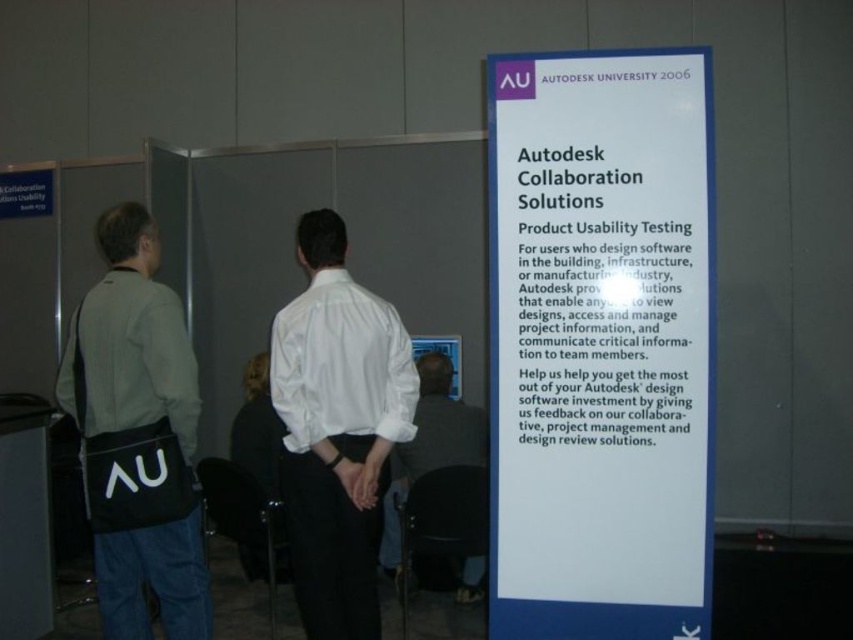
Question: Among these objects, which one is nearest to the camera?

Choices:
 (A) black fabric bag at left
 (B) white cotton shirt at center
 (C) white shirt at center

Answer: (A)

Question: Observing the image, what is the correct spatial positioning of white satin shirt at center in reference to white shirt at center?

Choices:
 (A) below
 (B) above

Answer: (B)

Question: Is white cotton shirt at center below white shirt at center?

Choices:
 (A) no
 (B) yes

Answer: (A)

Question: Can you confirm if black fabric bag at left is bigger than white shirt at center?

Choices:
 (A) no
 (B) yes

Answer: (A)

Question: Which is nearer to the white satin shirt at center?

Choices:
 (A) white cotton shirt at center
 (B) white paper at upper center
 (C) black fabric bag at left
 (D) white shirt at center

Answer: (A)

Question: Which object appears closest to the camera in this image?

Choices:
 (A) white cotton shirt at center
 (B) white shirt at center
 (C) white satin shirt at center
 (D) black fabric bag at left

Answer: (D)